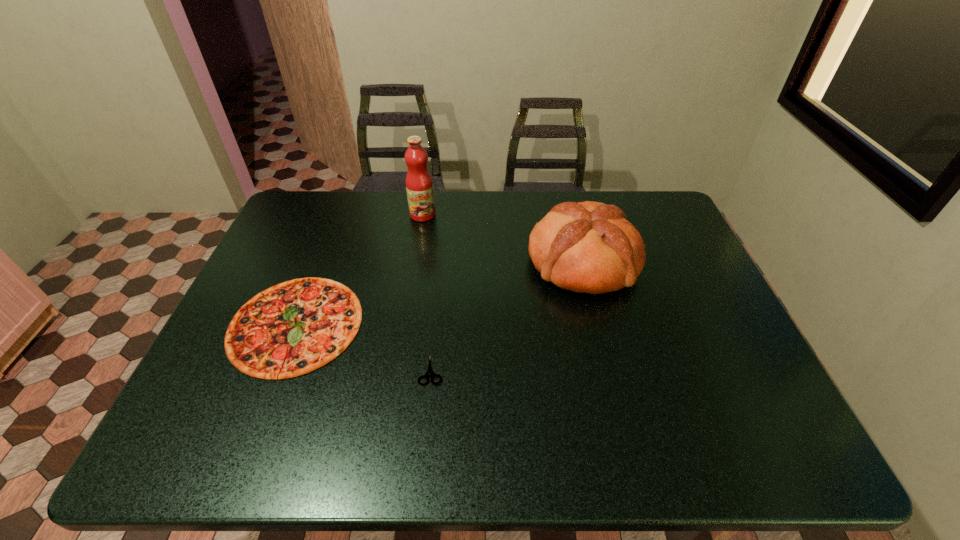
The image size is (960, 540). Find the location of `the tallest object`. the tallest object is located at coordinates (419, 185).

Find the location of a particular element. fruit juice is located at coordinates (419, 185).

At what (x,y) coordinates should I click in order to perform the action: click on bread. Please return your answer as a coordinate pair (x, y). Looking at the image, I should click on (589, 247).

You are a GUI agent. You are given a task and a screenshot of the screen. Output one action in this format:
    pyautogui.click(x=<x>, y=<y>)
    Task: Click on the second tallest object
    This screenshot has height=540, width=960.
    Given the screenshot: What is the action you would take?
    pyautogui.click(x=589, y=247)

Locate an element on the screen. The height and width of the screenshot is (540, 960). the third tallest object is located at coordinates [x=297, y=326].

You are a GUI agent. You are given a task and a screenshot of the screen. Output one action in this format:
    pyautogui.click(x=<x>, y=<y>)
    Task: Click on the leftmost object
    Image resolution: width=960 pixels, height=540 pixels.
    Given the screenshot: What is the action you would take?
    pyautogui.click(x=297, y=326)

The image size is (960, 540). I want to click on the third object from left to right, so click(430, 372).

This screenshot has height=540, width=960. I want to click on shears, so click(430, 372).

At what (x,y) coordinates should I click in order to perform the action: click on vacant position located 0.380m on the front label of the farthest object. Please return your answer as a coordinate pair (x, y). The height and width of the screenshot is (540, 960). Looking at the image, I should click on (408, 306).

This screenshot has width=960, height=540. What are the coordinates of `free space located on the left of the third shortest object` in the screenshot? It's located at pyautogui.click(x=488, y=262).